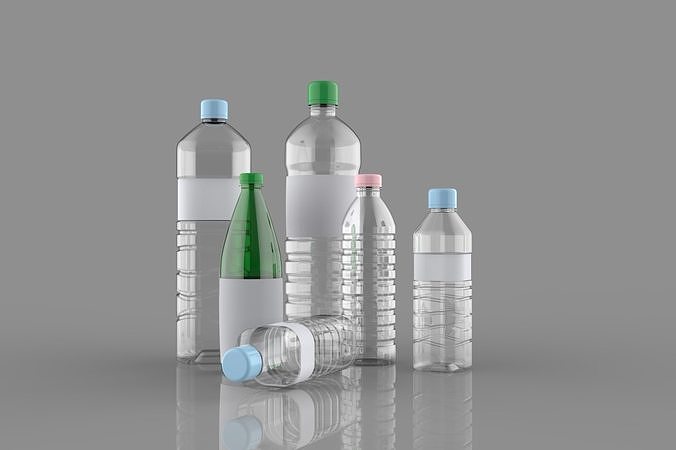
Find the location of a particular element. bottle is located at coordinates (197, 192), (245, 232), (322, 228), (318, 336), (368, 265), (443, 272).